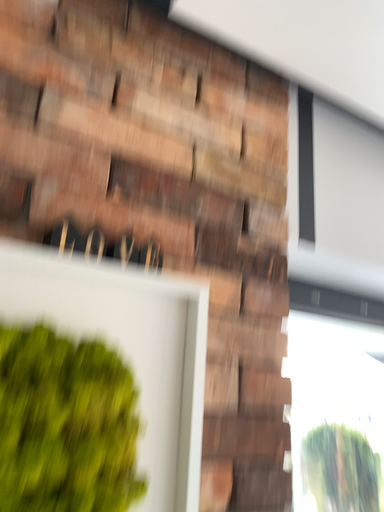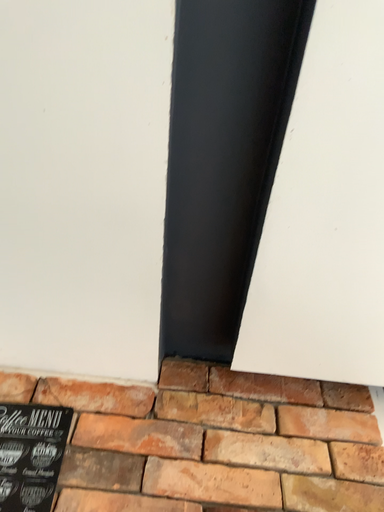
Question: Which way did the camera rotate in the video?

Choices:
 (A) rotated left
 (B) rotated right

Answer: (A)